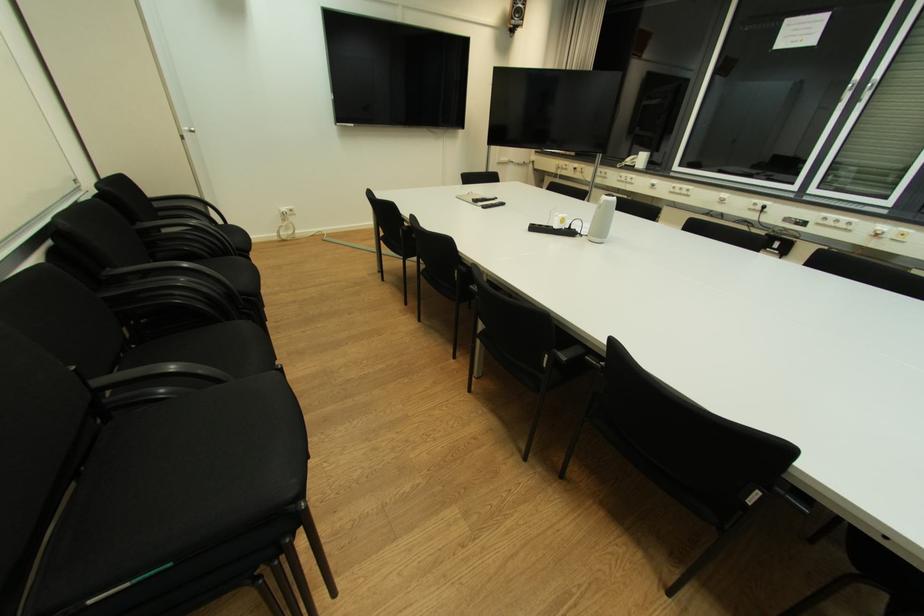
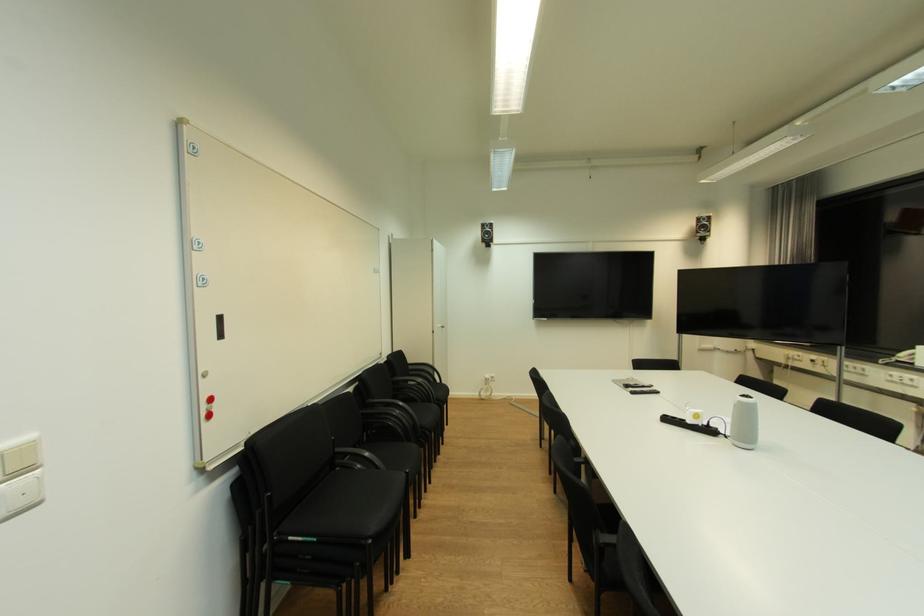
How did the camera likely rotate?

The rotation direction of the camera is left-up.